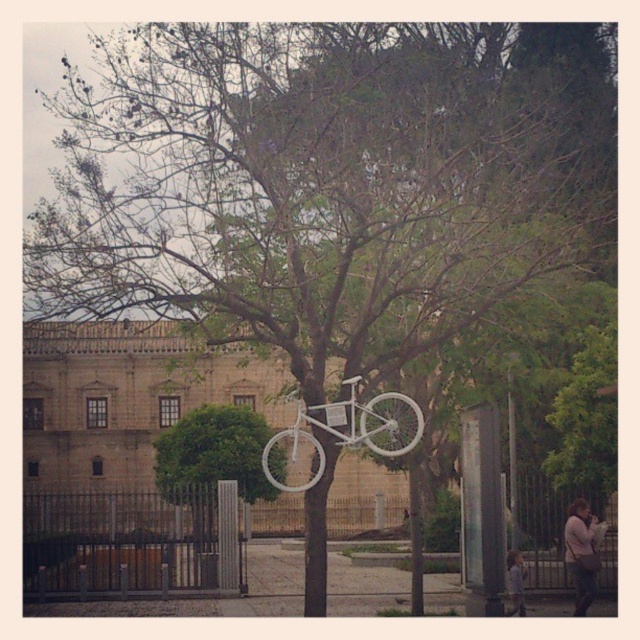
Measure the distance between white matte bicycle at center and metallic pole at center.

They are 6.08 meters apart.

Can you confirm if white matte bicycle at center is bigger than metallic pole at center?

Correct, white matte bicycle at center is larger in size than metallic pole at center.

At what (x,y) coordinates should I click in order to perform the action: click on white matte bicycle at center. Please return your answer as a coordinate pair (x, y). This screenshot has height=640, width=640. Looking at the image, I should click on [x=349, y=429].

This screenshot has height=640, width=640. In order to click on white matte bicycle at center in this screenshot , I will do `click(349, 429)`.

Between green leafy tree at center and white matte bicycle at center, which one is positioned lower?

green leafy tree at center is lower down.

Can you confirm if green leafy tree at center is positioned to the left of white matte bicycle at center?

Indeed, green leafy tree at center is positioned on the left side of white matte bicycle at center.

Measure the distance between point (198, 513) and camera.

Point (198, 513) and camera are 43.49 meters apart.

This screenshot has height=640, width=640. Find the location of `green leafy tree at center`. green leafy tree at center is located at coordinates (211, 460).

Who is positioned more to the left, green leafy tree at center or metallic pole at center?

green leafy tree at center

The width and height of the screenshot is (640, 640). What do you see at coordinates (211, 460) in the screenshot?
I see `green leafy tree at center` at bounding box center [211, 460].

The width and height of the screenshot is (640, 640). What are the coordinates of `green leafy tree at center` in the screenshot? It's located at (211, 460).

The width and height of the screenshot is (640, 640). Identify the location of green leafy tree at center. (211, 460).